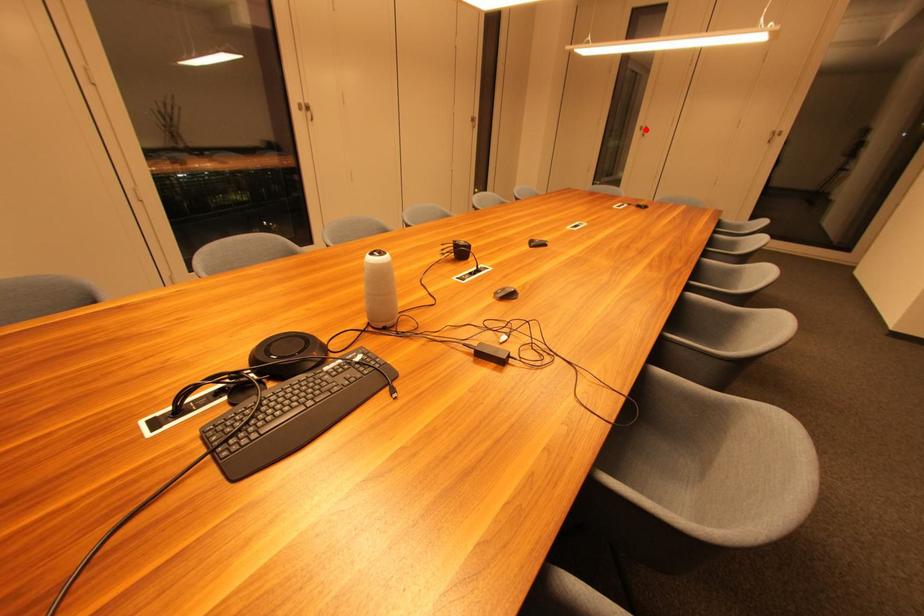
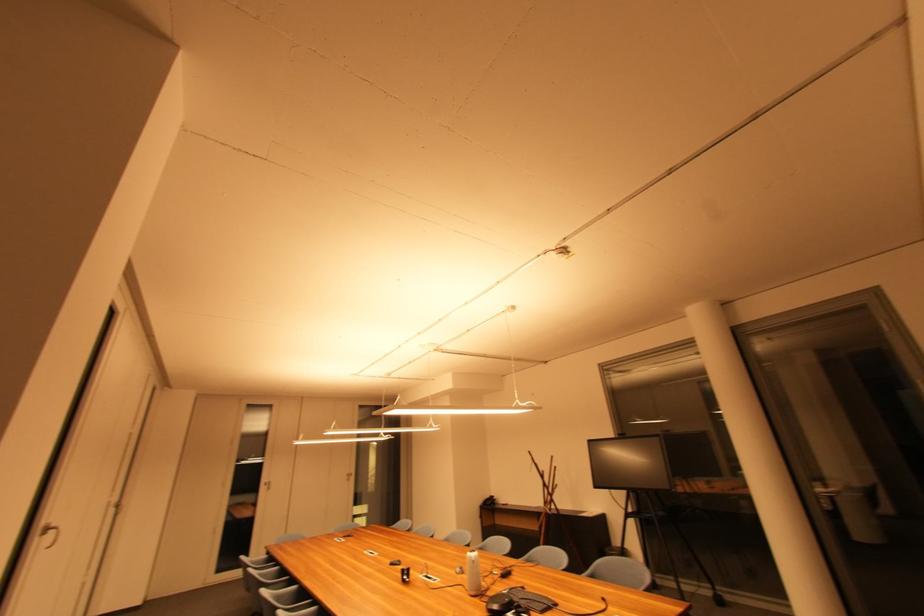
In the second image, find the point that corresponds to the highlighted location in the first image.

(271, 485)